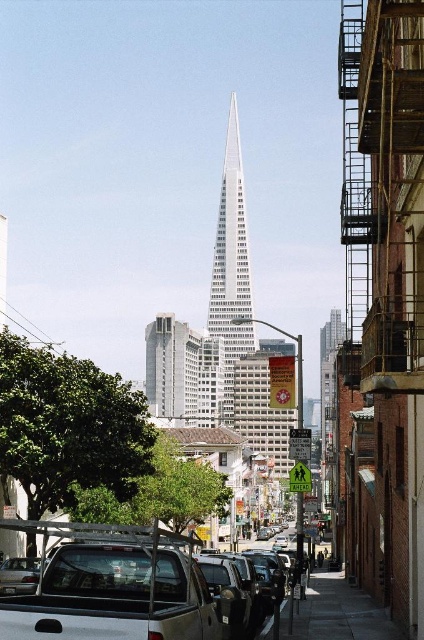
You are a city planner assessing the urban layout. Considering the white matte truck at lower left and the white glass skyscraper at center, which object is shorter in height?

The white matte truck at lower left is shorter than the white glass skyscraper at center.

You are a delivery driver who needs to park your vehicle in the area shown in the image. The parking spot you want to use is located at coordinates point 0.917, 0.264. Is the white matte truck at lower left currently occupying that parking spot?

Yes, the white matte truck at lower left is occupying the parking spot at coordinates point (111, 586) as stated in the objects description.